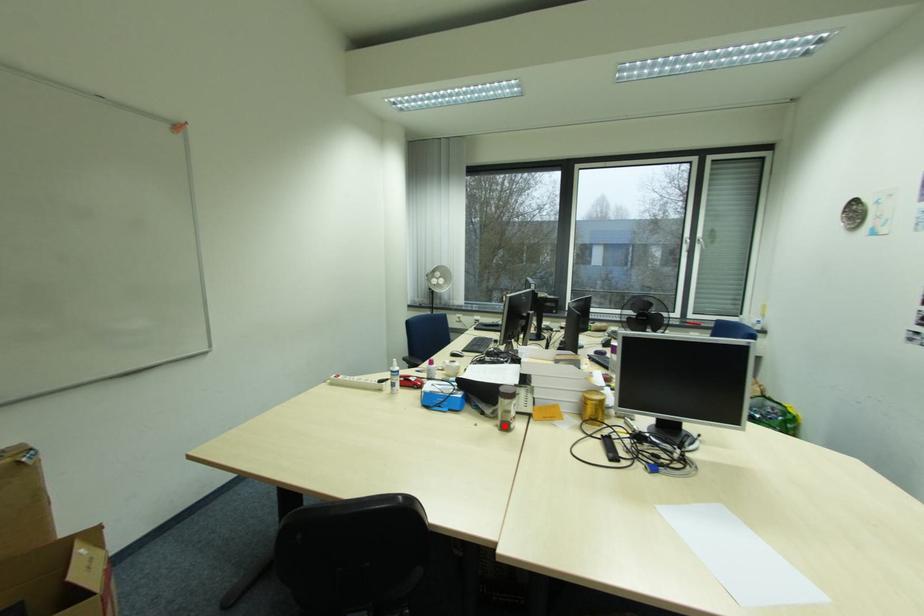
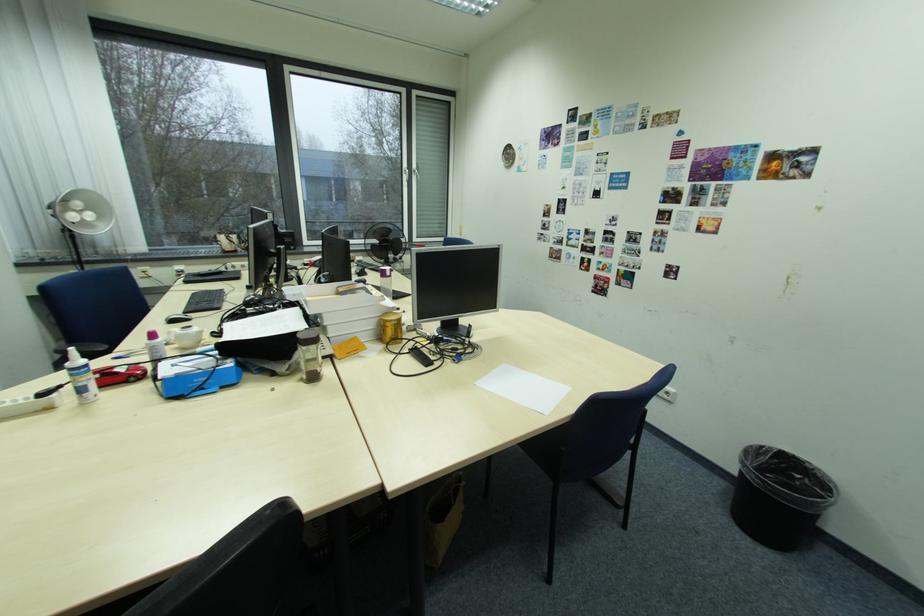
Find the pixel in the second image that matches the highlighted location in the first image.

(310, 381)